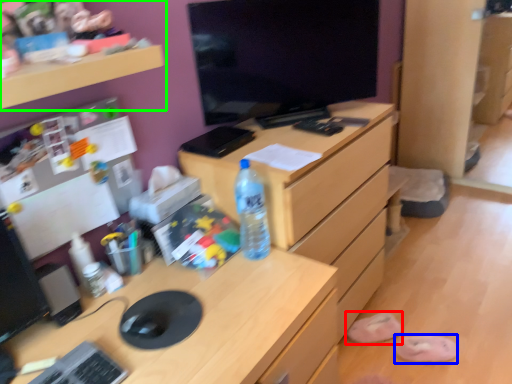
Question: Which is nearer to the slipper (highlighted by a red box)? slipper (highlighted by a blue box) or shelf (highlighted by a green box).

Choices:
 (A) slipper
 (B) shelf

Answer: (A)